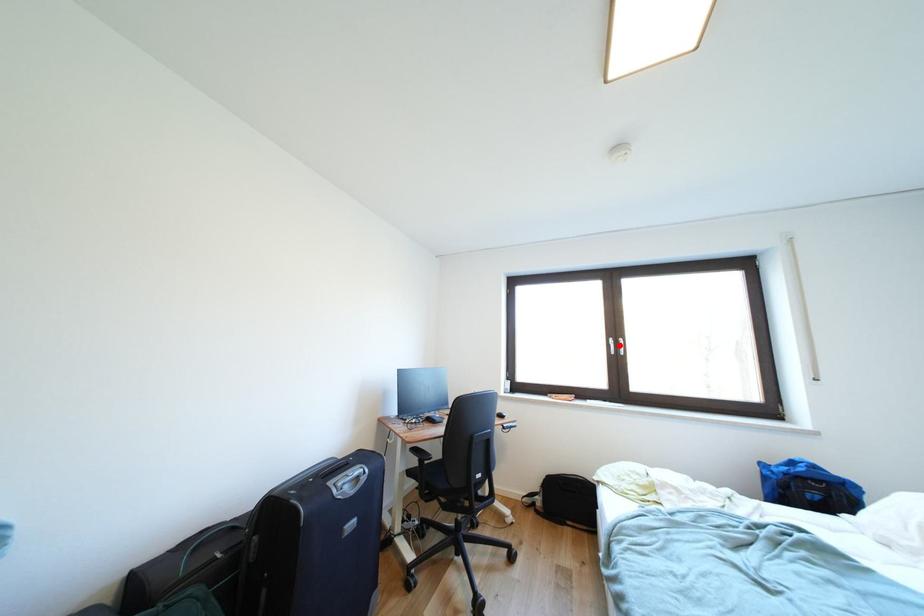
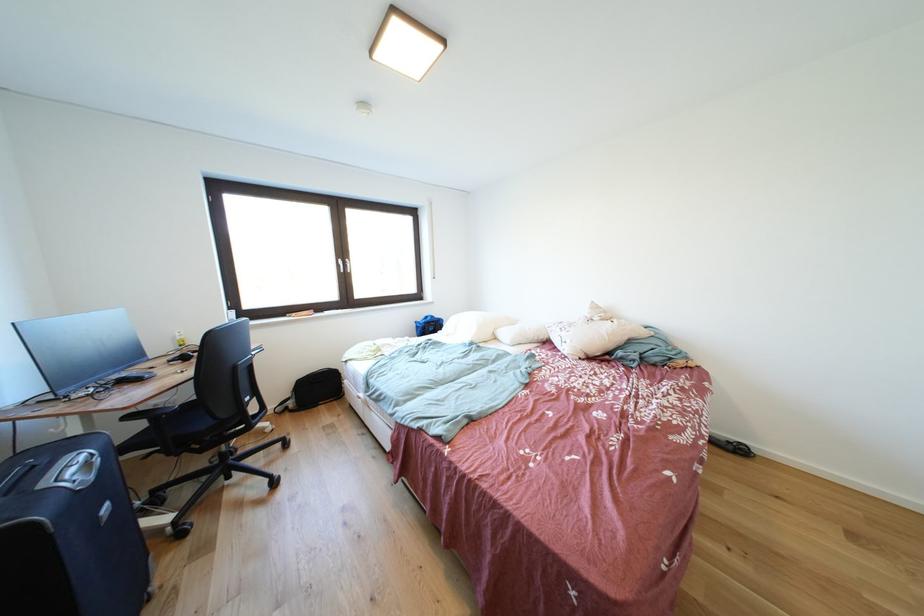
Where in the second image is the point corresponding to the highlighted location from the first image?

(348, 265)